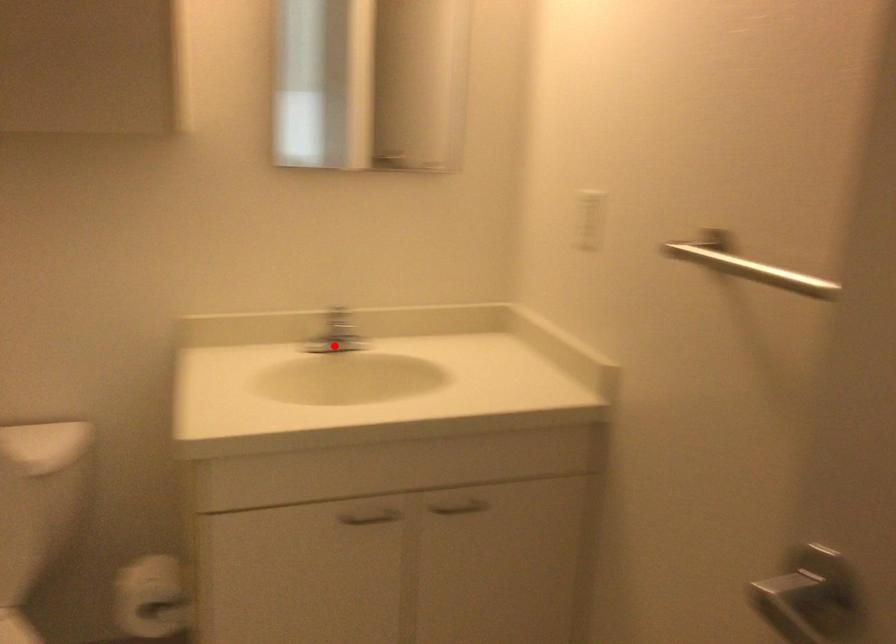
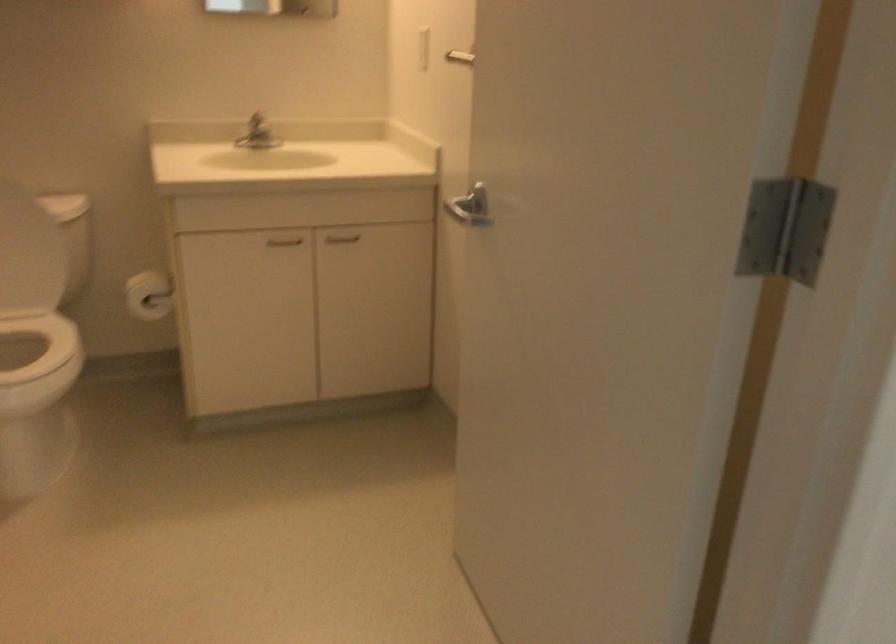
Question: A red point is marked in image1. In image2, is the corresponding 3D point closer to the camera or farther? Reply with the corresponding letter.

Choices:
 (A) The corresponding 3D point is closer.
 (B) The corresponding 3D point is farther.

Answer: (B)